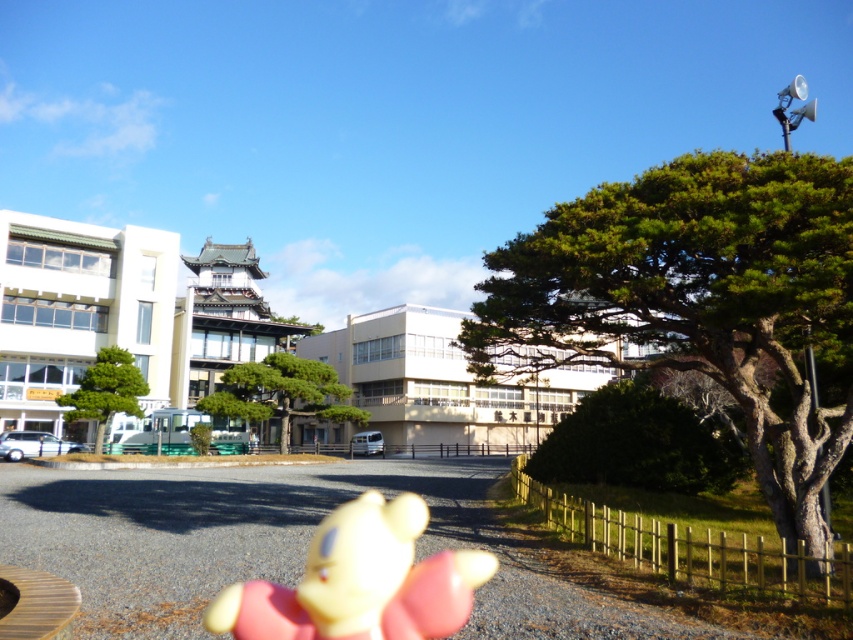
Question: Which object is the closest to the green matte tree at center?

Choices:
 (A) yellow matte teddy bear at lower center
 (B) green textured tree at center
 (C) green textured tree at right

Answer: (B)

Question: Can you confirm if green textured tree at right is wider than yellow matte teddy bear at lower center?

Choices:
 (A) no
 (B) yes

Answer: (B)

Question: From the image, what is the correct spatial relationship of green textured tree at right in relation to yellow matte teddy bear at lower center?

Choices:
 (A) below
 (B) above

Answer: (B)

Question: Among these objects, which one is farthest from the camera?

Choices:
 (A) yellow matte teddy bear at lower center
 (B) green textured tree at right

Answer: (B)

Question: Is green textured tree at center smaller than green matte tree at center?

Choices:
 (A) no
 (B) yes

Answer: (A)

Question: Among these objects, which one is nearest to the camera?

Choices:
 (A) yellow matte teddy bear at lower center
 (B) green textured tree at right
 (C) green matte tree at center
 (D) green textured tree at center

Answer: (A)